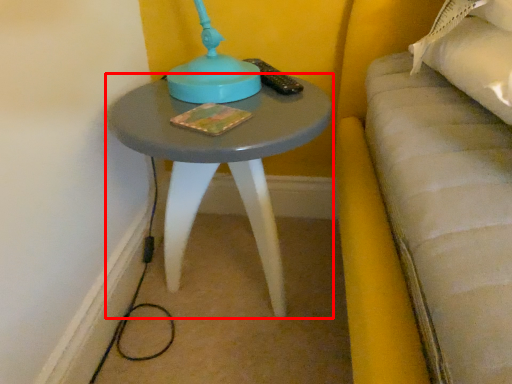
Question: Observing the image, what is the correct spatial positioning of table (annotated by the red box) in reference to book?

Choices:
 (A) left
 (B) right

Answer: (B)